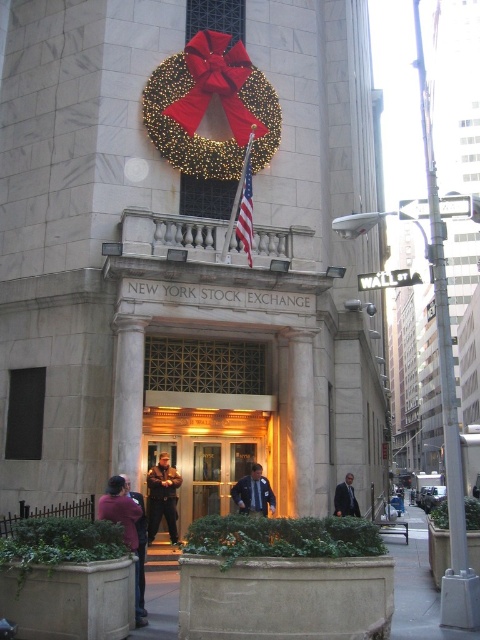
You are a photographer standing in front of the New York Stock Exchange entrance. You notice a brown leather jacket at center and a dark blue uniform at center. Which clothing item is narrower?

The brown leather jacket at center is narrower than the dark blue uniform at center.

You are standing at the entrance of the New York Stock Exchange and want to take a photo of the festive wreath with the large red bow. The wreath is located at point (x=188, y=157). If you are currently 44.15 meters away from this point, is this distance too far to capture the wreath clearly in your photo?

The point (x=188, y=157) is 44.15 meters away from the camera. This distance might be too far to capture the festive wreath with the large red bow clearly in the photo, as most cameras require closer proximity for detailed shots of specific objects like wreaths.

You are standing at the entrance of the New York Stock Exchange and notice the iridescent gold wreath at upper center and the dark blue uniform at center. Which object appears closer to you?

The iridescent gold wreath at upper center appears closer to you because it is further to the viewer than the dark blue uniform at center.